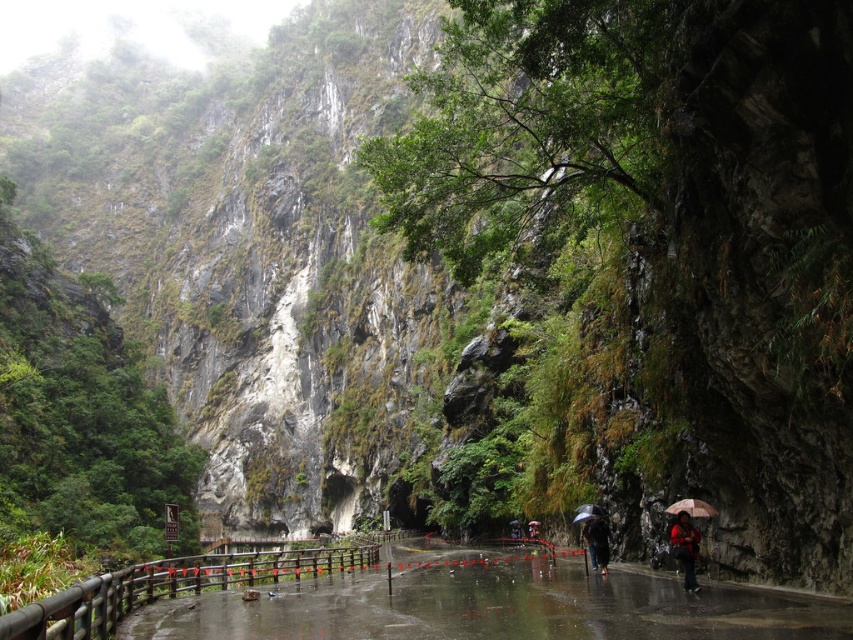
Between transparent plastic umbrella at center and red umbrella at center, which one has less height?

red umbrella at center

Can you confirm if transparent plastic umbrella at center is positioned to the left of red umbrella at center?

Incorrect, transparent plastic umbrella at center is not on the left side of red umbrella at center.

Which is behind, point (601, 512) or point (529, 529)?

The point (529, 529) is behind.

Find the location of a particular element. The height and width of the screenshot is (640, 853). transparent plastic umbrella at center is located at coordinates (589, 513).

Does wet asphalt path at center appear under dark brown umbrella at center?

Yes.

Is point (509, 561) more distant than point (592, 552)?

Yes, point (509, 561) is farther from viewer.

Image resolution: width=853 pixels, height=640 pixels. What do you see at coordinates (489, 605) in the screenshot? I see `wet asphalt path at center` at bounding box center [489, 605].

Where is `wet asphalt path at center`? Image resolution: width=853 pixels, height=640 pixels. wet asphalt path at center is located at coordinates point(489,605).

From the picture: Can you confirm if red matte jacket at lower right is thinner than dark brown umbrella at center?

Incorrect, red matte jacket at lower right's width is not less than dark brown umbrella at center's.

Which is more to the right, red matte jacket at lower right or dark brown umbrella at center?

From the viewer's perspective, red matte jacket at lower right appears more on the right side.

Which is in front, point (677, 531) or point (601, 561)?

Point (677, 531) is in front.

Identify the location of red matte jacket at lower right. coord(685,548).